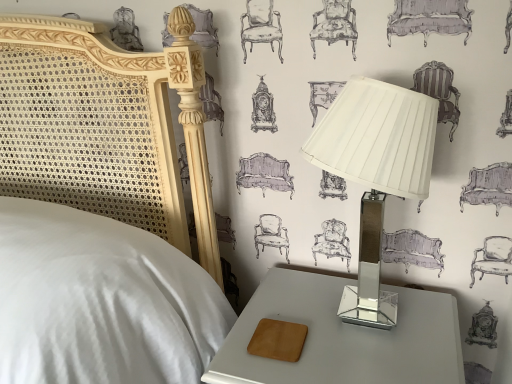
Question: Is metallic silver lamp at right taller or shorter than metallic gray nightstand at lower right?

Choices:
 (A) short
 (B) tall

Answer: (B)

Question: Is metallic silver lamp at right situated inside metallic gray nightstand at lower right or outside?

Choices:
 (A) outside
 (B) inside

Answer: (A)

Question: In the image, is metallic silver lamp at right positioned in front of or behind metallic gray nightstand at lower right?

Choices:
 (A) front
 (B) behind

Answer: (A)

Question: Do you think metallic gray nightstand at lower right is within metallic silver lamp at right, or outside of it?

Choices:
 (A) outside
 (B) inside

Answer: (A)

Question: In the image, is metallic gray nightstand at lower right positioned in front of or behind metallic silver lamp at right?

Choices:
 (A) behind
 (B) front

Answer: (A)

Question: In terms of height, does metallic gray nightstand at lower right look taller or shorter compared to metallic silver lamp at right?

Choices:
 (A) short
 (B) tall

Answer: (A)

Question: Is point (404, 309) closer or farther from the camera than point (397, 89)?

Choices:
 (A) closer
 (B) farther

Answer: (B)